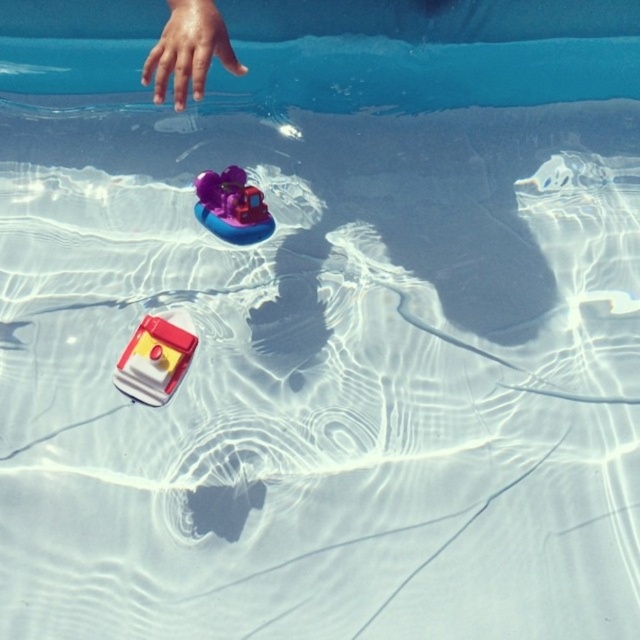
Locate an element on the screen. matte red boat at lower left is located at coordinates (154, 360).

Which is behind, point (141, 396) or point (218, 188)?

The point (218, 188) is more distant.

Where is `matte red boat at lower left`? The image size is (640, 640). matte red boat at lower left is located at coordinates [x=154, y=360].

Can you confirm if smooth skin hand at upper left is thinner than matte red boat at lower left?

No.

You are a GUI agent. You are given a task and a screenshot of the screen. Output one action in this format:
    pyautogui.click(x=<x>, y=<y>)
    Task: Click on the smooth skin hand at upper left
    
    Given the screenshot: What is the action you would take?
    pyautogui.click(x=188, y=51)

Where is `smooth skin hand at upper left`? This screenshot has width=640, height=640. smooth skin hand at upper left is located at coordinates (188, 51).

Who is taller, smooth skin hand at upper left or purple rubber duck at center?

smooth skin hand at upper left

Can you confirm if smooth skin hand at upper left is wider than purple rubber duck at center?

Yes.

Who is more distant from viewer, (x=193, y=80) or (x=224, y=212)?

The point (x=224, y=212) is behind.

Where is `smooth skin hand at upper left`? smooth skin hand at upper left is located at coordinates (188, 51).